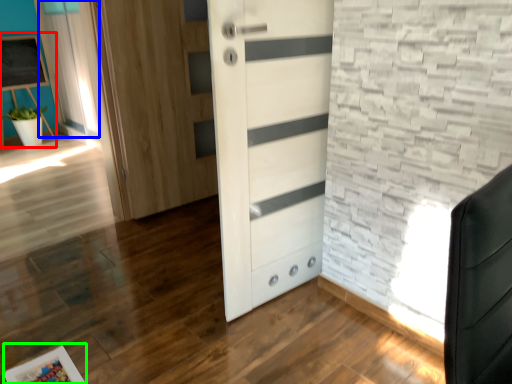
Question: Which is farther away from bulletin board (highlighted by a red box)? curtain (highlighted by a blue box) or picture frame (highlighted by a green box)?

Choices:
 (A) curtain
 (B) picture frame

Answer: (B)